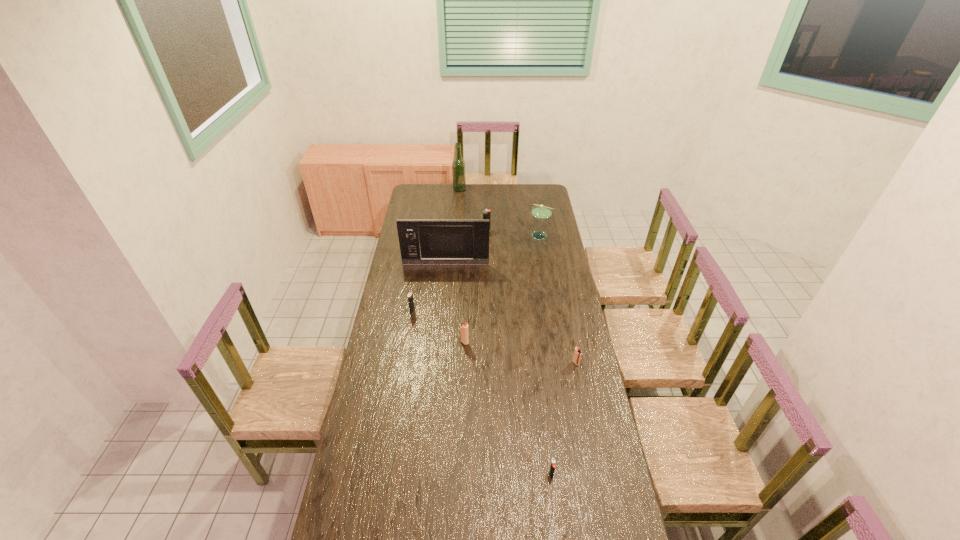
You are a GUI agent. You are given a task and a screenshot of the screen. Output one action in this format:
    pyautogui.click(x=<x>, y=<y>)
    Task: Click on the vacant space at the left edge
    The width and height of the screenshot is (960, 540).
    Given the screenshot: What is the action you would take?
    pyautogui.click(x=408, y=320)

Where is `vacant space at the right edge of the desktop`? This screenshot has width=960, height=540. vacant space at the right edge of the desktop is located at coordinates (551, 352).

I want to click on free space at the far right corner, so click(542, 188).

The image size is (960, 540). Find the location of `free spot between the martini and the farthest object`. free spot between the martini and the farthest object is located at coordinates (500, 212).

Identify the location of vacant region between the third nearest object and the fourth nearest object. The image size is (960, 540). (439, 327).

At what (x,y) coordinates should I click in order to perform the action: click on free space between the third nearest object and the farthest object. Please return your answer as a coordinate pair (x, y). The image size is (960, 540). Looking at the image, I should click on (462, 266).

Find the location of a particular element. The image size is (960, 540). free space that is in between the farther red igniter and the farthest object is located at coordinates (462, 266).

Identify the location of free space between the nearest igniter and the tallest igniter. (519, 353).

Locate an element on the screen. Image resolution: width=960 pixels, height=540 pixels. object that ranks as the closest to the microwave oven is located at coordinates (486, 213).

In order to click on object that is the nearest to the smaller red igniter in this screenshot , I will do `click(464, 337)`.